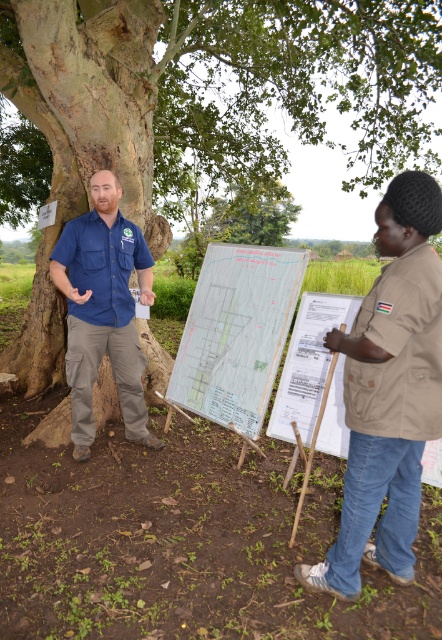
Question: Among these points, which one is nearest to the camera?

Choices:
 (A) click(x=106, y=288)
 (B) click(x=400, y=419)

Answer: (B)

Question: Is brown fabric shirt at right above matte blue shirt at left?

Choices:
 (A) yes
 (B) no

Answer: (B)

Question: Is brown rough tree at left below matte blue shirt at left?

Choices:
 (A) no
 (B) yes

Answer: (A)

Question: Which point is closer to the camera?

Choices:
 (A) white paper map at center
 (B) brown rough tree at left
 (C) brown fabric shirt at right

Answer: (C)

Question: Can you confirm if brown fabric shirt at right is smaller than white paper map at center?

Choices:
 (A) yes
 (B) no

Answer: (A)

Question: Which object is positioned farthest from the brown fabric shirt at right?

Choices:
 (A) matte blue shirt at left
 (B) brown rough tree at left
 (C) white paper map at center

Answer: (B)